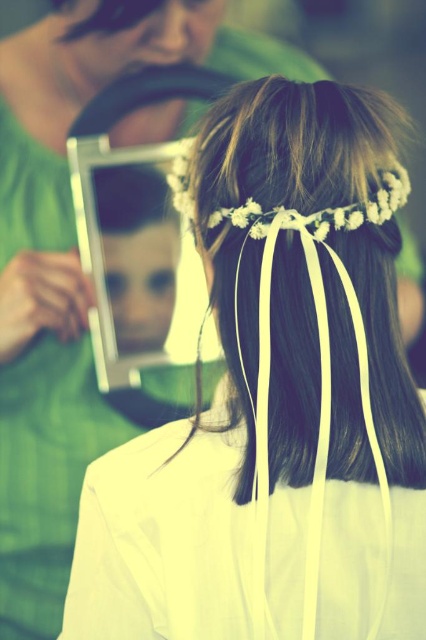
You are a photographer taking a picture of the child and the adult. You notice the metallic silver frame at upper center and the silky brown hair at upper center in your camera viewfinder. To ensure both are clearly visible in the photo, which object should you focus on first, the one closer to the camera or the one further away? Explain your reasoning based on their positions.

The metallic silver frame at upper center is located below the silky brown hair at upper center. Since the silky brown hair at upper center is positioned above the metallic silver frame, it is closer to the camera. Therefore, you should focus on the silky brown hair at upper center first to ensure it is in sharp focus before adjusting for the metallic silver frame at upper center.

You are a photographer trying to capture the reflection in the mirror. The metallic silver frame at upper center and silky brown hair at upper center are both visible in the mirror. Which object appears taller in the reflection?

The metallic silver frame at upper center appears taller than the silky brown hair at upper center in the reflection because it is much taller as mentioned in the description.

You are a photographer capturing this moment. You notice the metallic silver frame at upper center and the silky brown hair at upper center. Which object is closer to the camera?

The metallic silver frame at upper center is closer to the camera because the silky brown hair at upper center is behind it.